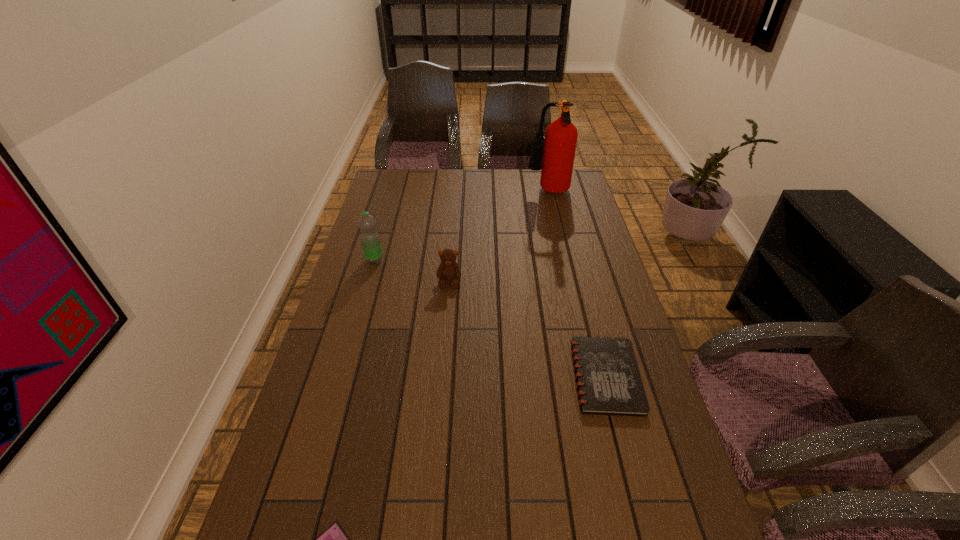
In order to click on vacant region located 0.120m at the nozzle of the farthest object in this screenshot , I will do `click(498, 193)`.

Where is `vacant space located on the front of the water bottle`? vacant space located on the front of the water bottle is located at coordinates (356, 323).

This screenshot has height=540, width=960. Find the location of `vacant space located on the face of the third nearest object`. vacant space located on the face of the third nearest object is located at coordinates (442, 373).

The width and height of the screenshot is (960, 540). Find the location of `free location located 0.270m on the back of the second nearest object`. free location located 0.270m on the back of the second nearest object is located at coordinates (581, 280).

Locate an element on the screen. The width and height of the screenshot is (960, 540). object that is at the far edge is located at coordinates (560, 140).

You are a GUI agent. You are given a task and a screenshot of the screen. Output one action in this format:
    pyautogui.click(x=<x>, y=<y>)
    Task: Click on the object at the left edge
    The width and height of the screenshot is (960, 540).
    Given the screenshot: What is the action you would take?
    pyautogui.click(x=370, y=240)

Image resolution: width=960 pixels, height=540 pixels. Identify the location of fire extinguisher present at the right edge. (560, 140).

The image size is (960, 540). Identify the location of notebook present at the right edge. (608, 379).

Identify the location of object that is positioned at the far right corner. The image size is (960, 540). (560, 140).

This screenshot has height=540, width=960. I want to click on free space at the far edge of the desktop, so click(x=509, y=184).